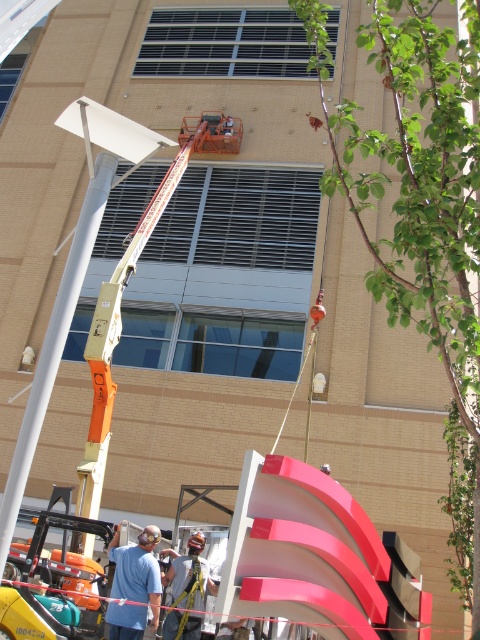
Question: Is blue cotton shirt at lower left thinner than metallic safety harness at center?

Choices:
 (A) yes
 (B) no

Answer: (B)

Question: Which object appears farthest from the camera in this image?

Choices:
 (A) blue cotton shirt at lower left
 (B) metallic safety harness at center

Answer: (B)

Question: Which point is farther from the camera taking this photo?

Choices:
 (A) (181, 636)
 (B) (159, 592)

Answer: (A)

Question: Can you confirm if blue cotton shirt at lower left is wider than metallic safety harness at center?

Choices:
 (A) yes
 (B) no

Answer: (A)

Question: Can you confirm if blue cotton shirt at lower left is positioned above metallic safety harness at center?

Choices:
 (A) no
 (B) yes

Answer: (B)